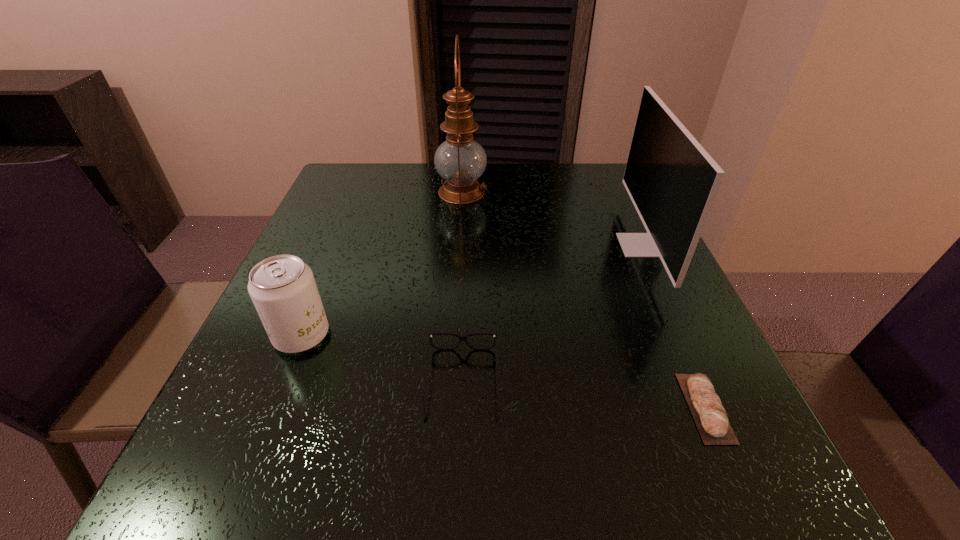
Where is `free space between the pita bread and the third tallest object`? This screenshot has height=540, width=960. free space between the pita bread and the third tallest object is located at coordinates (503, 372).

Locate an element on the screen. Image resolution: width=960 pixels, height=540 pixels. empty space between the pita bread and the leftmost object is located at coordinates (503, 372).

Locate an element on the screen. empty space that is in between the tallest object and the soda can is located at coordinates (382, 264).

Where is `vacant region between the oil lamp and the spectacles`? This screenshot has height=540, width=960. vacant region between the oil lamp and the spectacles is located at coordinates (462, 287).

The width and height of the screenshot is (960, 540). Find the location of `blank region between the tallest object and the monitor`. blank region between the tallest object and the monitor is located at coordinates (551, 219).

Where is `vacant space in between the tallest object and the soda can`? vacant space in between the tallest object and the soda can is located at coordinates (382, 264).

Identify which object is the closest to the oil lamp. Please provide its 2D coordinates. Your answer should be formatted as a tuple, i.e. [(x, y)], where the tuple contains the x and y coordinates of a point satisfying the conditions above.

[(672, 181)]

Locate which object is the closest to the monitor. Please provide its 2D coordinates. Your answer should be formatted as a tuple, i.e. [(x, y)], where the tuple contains the x and y coordinates of a point satisfying the conditions above.

[(710, 417)]

Where is `free space that satisfies the following two spatial constraints: 1. with the lenses facing outward on the pita bread; 2. on the right side of the second shortest object`? The width and height of the screenshot is (960, 540). free space that satisfies the following two spatial constraints: 1. with the lenses facing outward on the pita bread; 2. on the right side of the second shortest object is located at coordinates (462, 408).

Identify the location of free region that satisfies the following two spatial constraints: 1. on the front-facing side of the second tallest object; 2. with the lenses facing outward on the fourth tallest object. This screenshot has width=960, height=540. (704, 382).